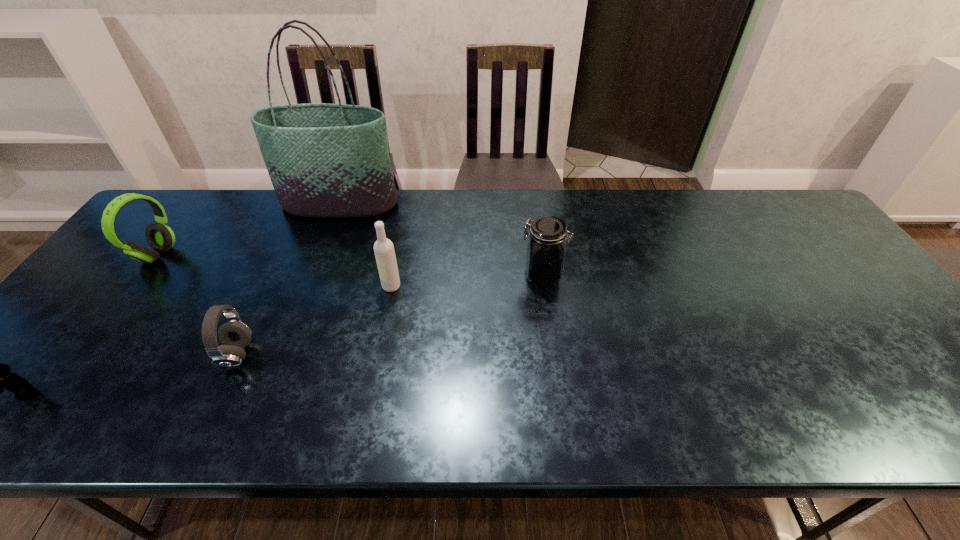
I want to click on Lego that is at the left edge, so click(x=0, y=376).

This screenshot has width=960, height=540. I want to click on object present at the near left corner, so click(0, 376).

Where is `vacant space at the far edge`? vacant space at the far edge is located at coordinates (469, 234).

This screenshot has height=540, width=960. What are the coordinates of `vacant area at the near edge` in the screenshot? It's located at (787, 408).

Locate an element on the screen. The height and width of the screenshot is (540, 960). vacant space at the right edge of the desktop is located at coordinates (831, 321).

Where is `vacant space at the far right corner`? vacant space at the far right corner is located at coordinates (787, 208).

I want to click on vacant area between the jar and the vodka, so click(x=467, y=280).

What are the coordinates of `free space that is in between the vodka and the rightmost object` in the screenshot? It's located at (467, 280).

I want to click on vacant space that's between the second object from right to left and the right headset, so click(x=314, y=320).

What are the coordinates of `empty location between the Lego and the left headset` in the screenshot? It's located at (92, 325).